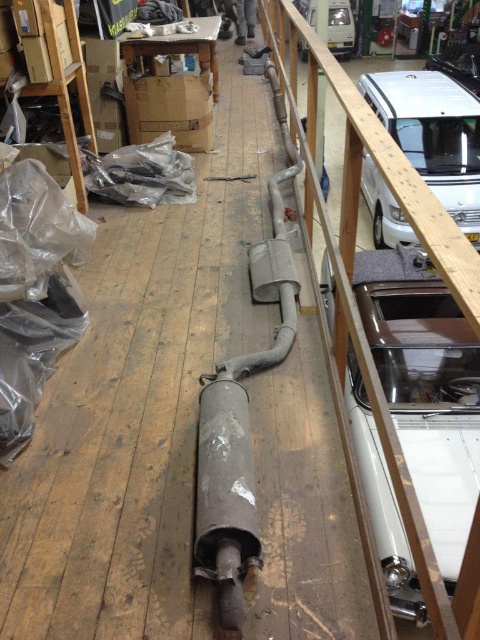
Who is more distant from viewer, (352, 243) or (339, 51)?

Point (339, 51)

Can you confirm if wooden at upper right is taller than white matte van at upper center?

Correct, wooden at upper right is much taller as white matte van at upper center.

Locate an element on the screen. wooden at upper right is located at coordinates pos(355,300).

Consider the image. Who is taller, wooden at upper right or metallic silver car at upper right?

Standing taller between the two is wooden at upper right.

The width and height of the screenshot is (480, 640). What are the coordinates of `wooden at upper right` in the screenshot? It's located at (355, 300).

You are a GUI agent. You are given a task and a screenshot of the screen. Output one action in this format:
    pyautogui.click(x=<x>, y=<y>)
    Task: Click on the wooden at upper right
    
    Given the screenshot: What is the action you would take?
    pyautogui.click(x=355, y=300)

Does white matte van at upper center have a smaller size compared to metallic silver car at upper right?

Correct, white matte van at upper center occupies less space than metallic silver car at upper right.

Can you confirm if white matte van at upper center is positioned to the left of metallic silver car at upper right?

Correct, you'll find white matte van at upper center to the left of metallic silver car at upper right.

Is point (330, 13) closer to camera compared to point (447, 60)?

That is False.

Identify the location of white matte van at upper center. The width and height of the screenshot is (480, 640). (340, 28).